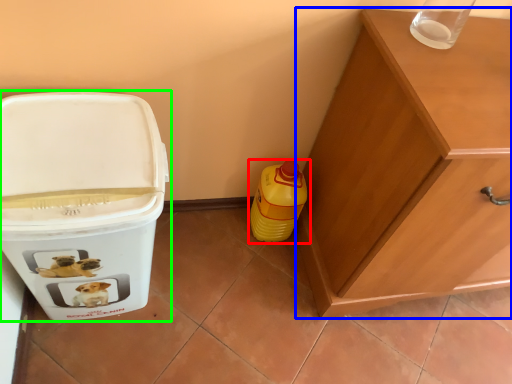
Question: Which object is the farthest from bottle (highlighted by a red box)? Choose among these: cabinetry (highlighted by a blue box) or waste container (highlighted by a green box).

Choices:
 (A) cabinetry
 (B) waste container

Answer: (B)